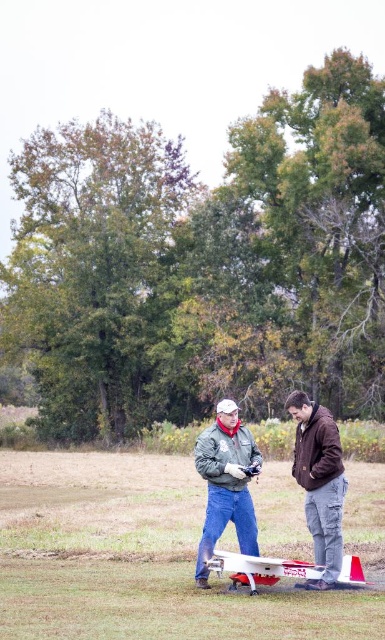
You are a photographer trying to capture both the matte gray jacket at center and the white matte airplane at center in a single frame. Based on their sizes, which object should you focus on first to ensure both are in the frame?

The matte gray jacket at center is not as tall as the white matte airplane at center, so you should focus on the white matte airplane at center first to ensure both are in the frame.

You are trying to decide which jacket to wear for a hike. Both the matte gray jacket at center and the gray matte jacket at center are available. Which one is wider?

The gray matte jacket at center is wider than the matte gray jacket at center.